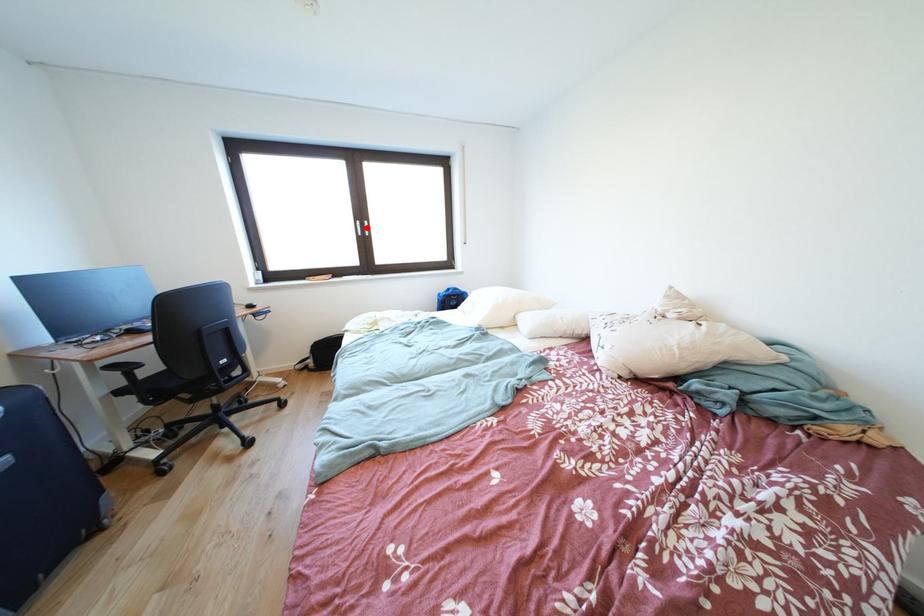
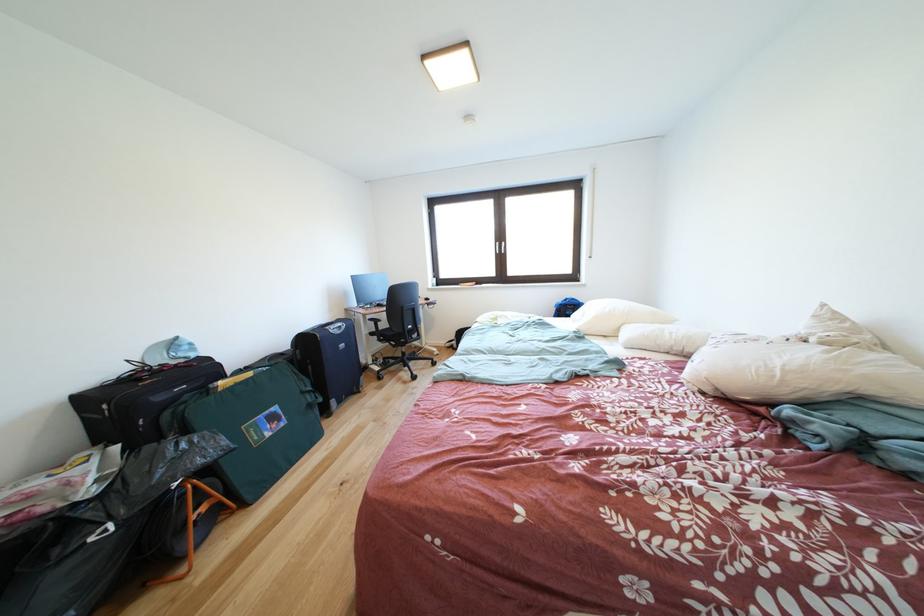
In the second image, find the point that corresponds to the highlighted location in the first image.

(505, 249)